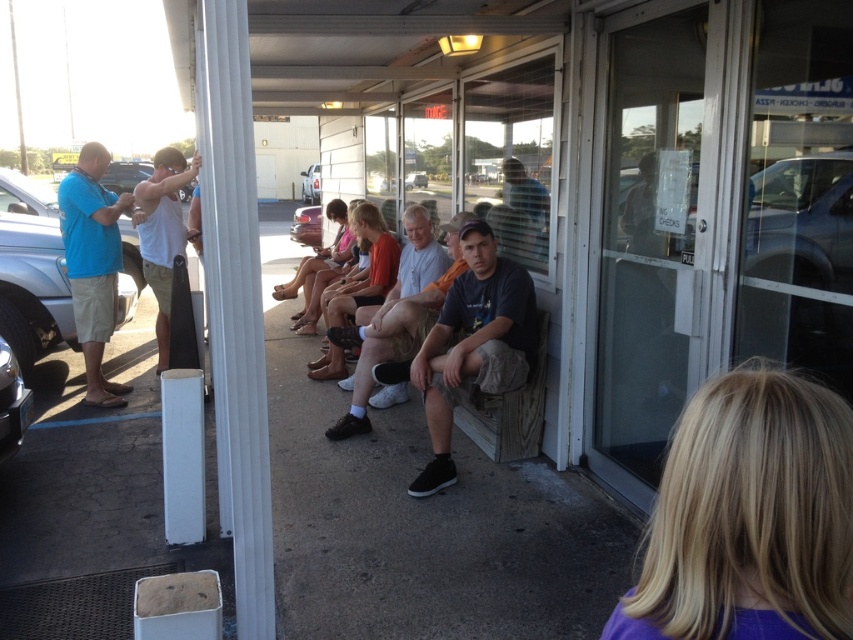
Question: Does white smooth pole at left come in front of orange cotton shirt at center?

Choices:
 (A) no
 (B) yes

Answer: (B)

Question: Is dark blue t-shirt at center above orange cotton shirt at center?

Choices:
 (A) yes
 (B) no

Answer: (B)

Question: Which point is closer to the camera taking this photo?

Choices:
 (A) (845, 516)
 (B) (83, 273)
 (C) (170, 227)
 (D) (300, 172)

Answer: (A)

Question: Is white smooth pole at left thinner than matte pink shirt at center?

Choices:
 (A) no
 (B) yes

Answer: (B)

Question: Which point is closer to the camera?

Choices:
 (A) (704, 481)
 (B) (244, 346)

Answer: (A)

Question: Which of the following is the closest to the observer?

Choices:
 (A) orange cotton shirt at center
 (B) matte pink shirt at center
 (C) white smooth pole at left

Answer: (C)